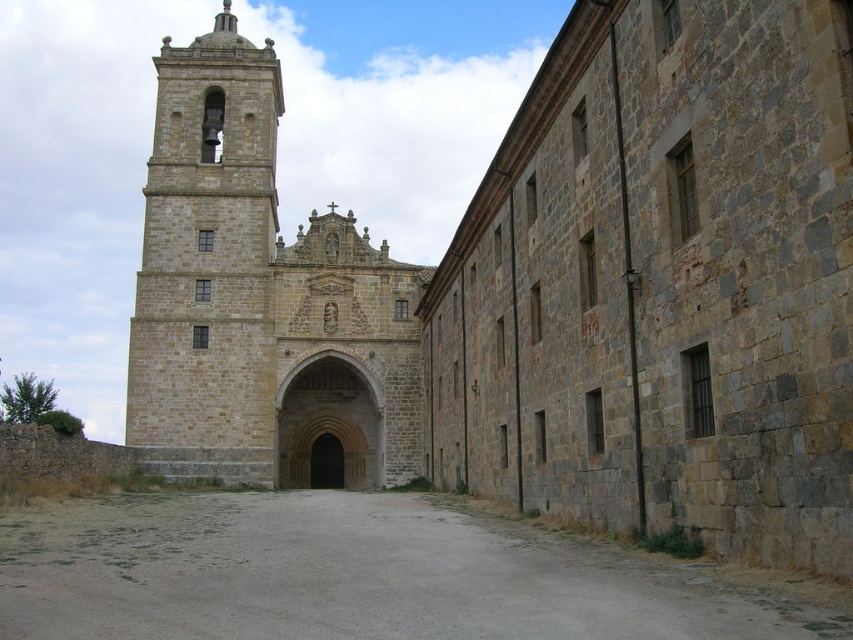
Between point (173, 467) and point (703, 620), which one is positioned behind?

The point (173, 467) is more distant.

Between point (134, 323) and point (440, 508), which one is positioned behind?

The point (134, 323) is behind.

Find the location of a particular element. The width and height of the screenshot is (853, 640). stone tower at center is located at coordinates click(x=259, y=298).